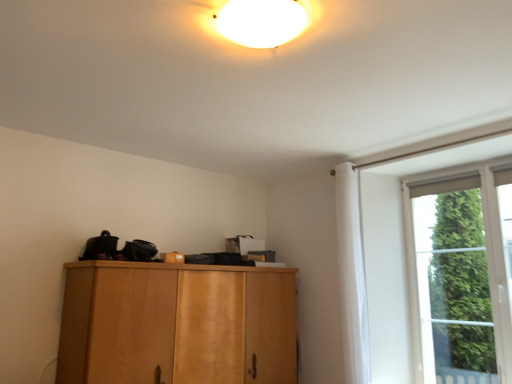
Question: Would you say white fabric curtain at right is to the left or to the right of light brown wood cabinet at center in the picture?

Choices:
 (A) right
 (B) left

Answer: (A)

Question: Based on their sizes in the image, would you say white fabric curtain at right is bigger or smaller than light brown wood cabinet at center?

Choices:
 (A) big
 (B) small

Answer: (B)

Question: Considering the real-world distances, which object is closest to the green glass window at right?

Choices:
 (A) light brown wood cabinet at center
 (B) white fabric curtain at right

Answer: (B)

Question: Considering the real-world distances, which object is farthest from the light brown wood cabinet at center?

Choices:
 (A) green glass window at right
 (B) white fabric curtain at right

Answer: (A)